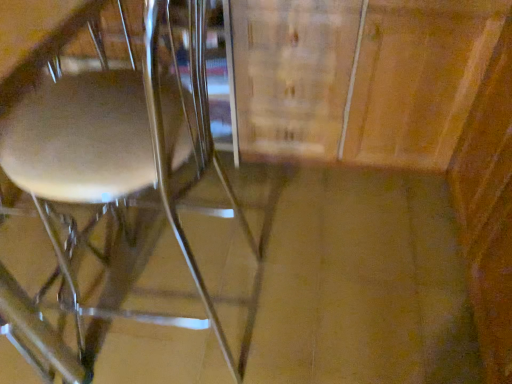
Where is `metallic silver chair at left`? The image size is (512, 384). metallic silver chair at left is located at coordinates click(x=110, y=160).

What is the approximate height of metallic silver chair at left?

The height of metallic silver chair at left is 1.03 meters.

The image size is (512, 384). What do you see at coordinates (110, 160) in the screenshot? I see `metallic silver chair at left` at bounding box center [110, 160].

At what (x,y) coordinates should I click in order to perform the action: click on wooden cabinet at center. Please return your answer as a coordinate pair (x, y). Looking at the image, I should click on (359, 77).

This screenshot has height=384, width=512. What do you see at coordinates (359, 77) in the screenshot?
I see `wooden cabinet at center` at bounding box center [359, 77].

Identify the location of metallic silver chair at left. (110, 160).

Considering the relative positions of wooden cabinet at center and metallic silver chair at left in the image provided, is wooden cabinet at center to the right of metallic silver chair at left from the viewer's perspective?

Yes.

Considering the relative positions of wooden cabinet at center and metallic silver chair at left in the image provided, is wooden cabinet at center in front of metallic silver chair at left?

No, it is behind metallic silver chair at left.

Considering the positions of point (346, 45) and point (99, 316), is point (346, 45) closer or farther from the camera than point (99, 316)?

Point (346, 45).

Based on the photo, from the image's perspective, is wooden cabinet at center above or below metallic silver chair at left?

wooden cabinet at center is situated higher than metallic silver chair at left in the image.

From a real-world perspective, which is physically above, wooden cabinet at center or metallic silver chair at left?

metallic silver chair at left, from a real-world perspective.

Between wooden cabinet at center and metallic silver chair at left, which one has smaller width?

wooden cabinet at center.

Considering the relative sizes of wooden cabinet at center and metallic silver chair at left in the image provided, is wooden cabinet at center taller than metallic silver chair at left?

In fact, wooden cabinet at center may be shorter than metallic silver chair at left.

Considering the sizes of objects wooden cabinet at center and metallic silver chair at left in the image provided, who is smaller, wooden cabinet at center or metallic silver chair at left?

With smaller size is wooden cabinet at center.

Based on the photo, can metallic silver chair at left be found inside wooden cabinet at center?

No, metallic silver chair at left is not inside wooden cabinet at center.

Is wooden cabinet at center far away from metallic silver chair at left?

No, there isn't a large distance between wooden cabinet at center and metallic silver chair at left.

Is wooden cabinet at center oriented away from metallic silver chair at left?

No, wooden cabinet at center is not facing away from metallic silver chair at left.

How far apart are wooden cabinet at center and metallic silver chair at left?

A distance of 26.62 inches exists between wooden cabinet at center and metallic silver chair at left.

Image resolution: width=512 pixels, height=384 pixels. Identify the location of chair that is in front of the wooden cabinet at center. (110, 160).

Based on their positions, is metallic silver chair at left located to the left or right of wooden cabinet at center?

metallic silver chair at left is positioned on wooden cabinet at center's left side.

In the image, is metallic silver chair at left positioned in front of or behind wooden cabinet at center?

metallic silver chair at left is positioned closer to the viewer than wooden cabinet at center.

Which is closer, (80, 8) or (430, 113)?

Positioned in front is point (80, 8).

From the image's perspective, which is below, metallic silver chair at left or wooden cabinet at center?

metallic silver chair at left appears lower in the image.

From a real-world perspective, does metallic silver chair at left sit lower than wooden cabinet at center?

Actually, metallic silver chair at left is physically above wooden cabinet at center in the real world.

In the scene shown: Considering the relative sizes of metallic silver chair at left and wooden cabinet at center in the image provided, is metallic silver chair at left thinner than wooden cabinet at center?

No.

Is metallic silver chair at left taller than wooden cabinet at center?

Yes.

From the picture: Based on their sizes in the image, would you say metallic silver chair at left is bigger or smaller than wooden cabinet at center?

In the image, metallic silver chair at left appears to be larger than wooden cabinet at center.

Is wooden cabinet at center inside metallic silver chair at left?

No.

Is metallic silver chair at left next to wooden cabinet at center?

No.

In the scene shown: Is metallic silver chair at left positioned with its back to wooden cabinet at center?

metallic silver chair at left is not turned away from wooden cabinet at center.

What are the coordinates of `cabinetry above the metallic silver chair at left (from the image's perspective)` in the screenshot? It's located at (359, 77).

This screenshot has width=512, height=384. In order to click on chair located below the wooden cabinet at center (from the image's perspective) in this screenshot , I will do `click(110, 160)`.

In order to click on cabinetry above the metallic silver chair at left (from the image's perspective) in this screenshot , I will do `click(359, 77)`.